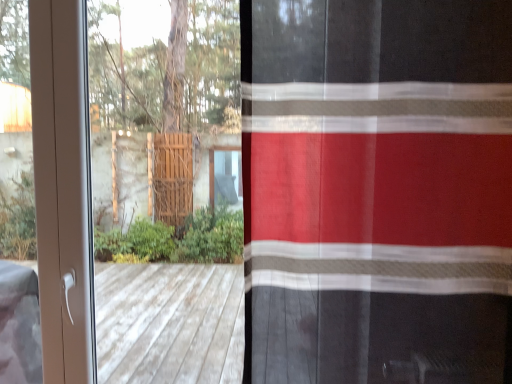
Question: Is white plastic screen door at left in front of or behind red sheer curtain at right in the image?

Choices:
 (A) behind
 (B) front

Answer: (A)

Question: Is white plastic screen door at left to the left or to the right of red sheer curtain at right in the image?

Choices:
 (A) right
 (B) left

Answer: (B)

Question: In terms of width, does white plastic screen door at left look wider or thinner when compared to red sheer curtain at right?

Choices:
 (A) thin
 (B) wide

Answer: (A)

Question: In terms of width, does red sheer curtain at right look wider or thinner when compared to white plastic screen door at left?

Choices:
 (A) thin
 (B) wide

Answer: (B)

Question: Considering their positions, is red sheer curtain at right located in front of or behind white plastic screen door at left?

Choices:
 (A) front
 (B) behind

Answer: (A)

Question: Which is correct: red sheer curtain at right is inside white plastic screen door at left, or outside of it?

Choices:
 (A) inside
 (B) outside

Answer: (B)

Question: In terms of height, does red sheer curtain at right look taller or shorter compared to white plastic screen door at left?

Choices:
 (A) tall
 (B) short

Answer: (B)